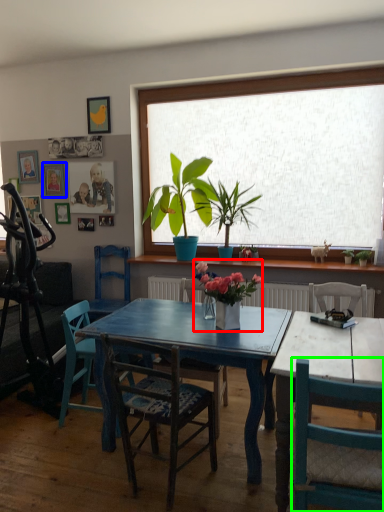
Question: Estimate the real-world distances between objects in this image. Which object is closer to houseplant (highlighted by a red box), picture frame (highlighted by a blue box) or chair (highlighted by a green box)?

Choices:
 (A) picture frame
 (B) chair

Answer: (B)